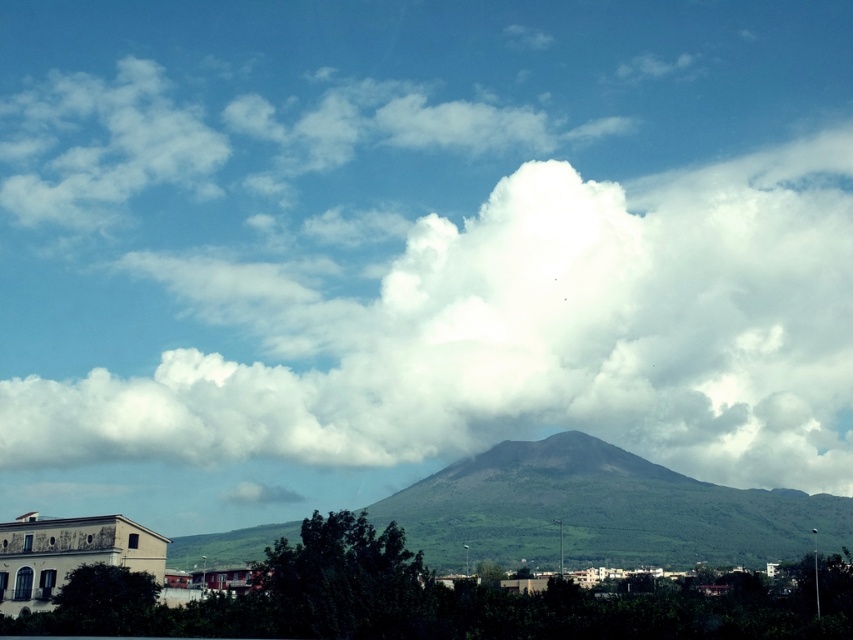
Does white fluffy cloud at upper center have a greater width compared to green matte mountain at center?

Yes.

Is white fluffy cloud at upper center smaller than green matte mountain at center?

No.

Does point (625, 433) come behind point (297, 536)?

Yes, it is.

Find the location of a particular element. white fluffy cloud at upper center is located at coordinates (511, 336).